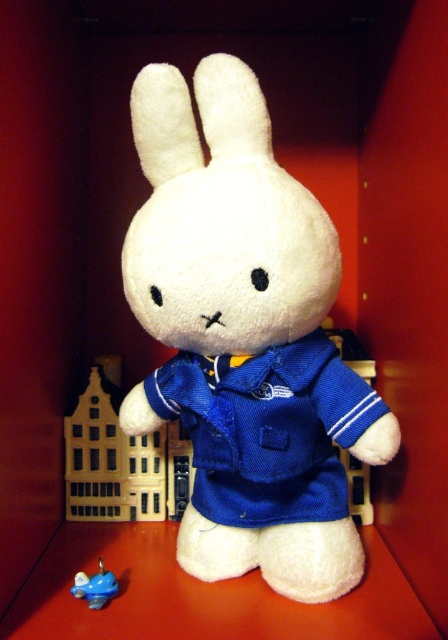
Question: Which point appears farthest from the camera in this image?

Choices:
 (A) (107, 572)
 (B) (240, 317)

Answer: (A)

Question: Is white plush rabbit at center below blue rubber duck at lower left?

Choices:
 (A) yes
 (B) no

Answer: (B)

Question: Is white plush rabbit at center below blue rubber duck at lower left?

Choices:
 (A) yes
 (B) no

Answer: (B)

Question: Is white plush rabbit at center below blue rubber duck at lower left?

Choices:
 (A) yes
 (B) no

Answer: (B)

Question: Which object appears closest to the camera in this image?

Choices:
 (A) blue rubber duck at lower left
 (B) white plush rabbit at center

Answer: (B)